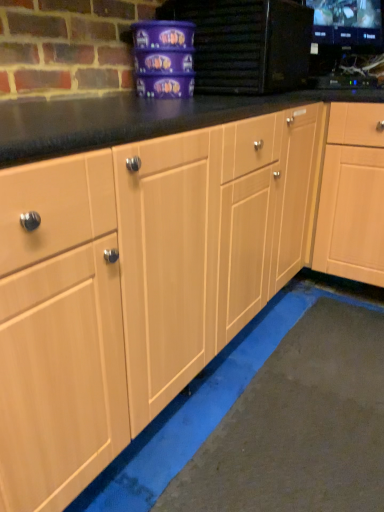
Question: Choose the correct answer: Is matte purple container at upper center, which is the second appliance in right-to-left order, inside black glossy tv at upper right, the second appliance when ordered from left to right, or outside it?

Choices:
 (A) outside
 (B) inside

Answer: (A)

Question: Does point (243, 4) appear closer or farther from the camera than point (360, 80)?

Choices:
 (A) closer
 (B) farther

Answer: (A)

Question: Which object is positioned farthest from the matte purple container at upper center, which is the second appliance in right-to-left order?

Choices:
 (A) black glossy monitor at upper right
 (B) light wood cabinet at center
 (C) black glossy tv at upper right, the second appliance when ordered from left to right

Answer: (A)

Question: Which is farther from the light wood cabinet at center?

Choices:
 (A) black glossy monitor at upper right
 (B) matte purple container at upper center, the first appliance in the left-to-right sequence
 (C) black glossy tv at upper right, which is the first appliance from right to left

Answer: (A)